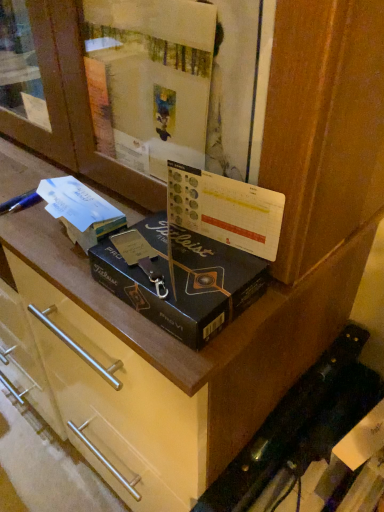
Question: Would you say black matte box at center is outside white paper at upper left?

Choices:
 (A) no
 (B) yes

Answer: (B)

Question: Is white paper at upper left a part of black matte box at center?

Choices:
 (A) yes
 (B) no

Answer: (B)

Question: From the image's perspective, would you say black matte box at center is positioned over white paper at upper left?

Choices:
 (A) no
 (B) yes

Answer: (A)

Question: From the image's perspective, is black matte box at center under white paper at upper left?

Choices:
 (A) no
 (B) yes

Answer: (B)

Question: Are black matte box at center and white paper at upper left located far from each other?

Choices:
 (A) no
 (B) yes

Answer: (A)

Question: Could you tell me if black matte box at center is facing white paper at upper left?

Choices:
 (A) yes
 (B) no

Answer: (B)

Question: Considering the relative positions of white paper at upper left and black matte box at center in the image provided, is white paper at upper left to the left of black matte box at center from the viewer's perspective?

Choices:
 (A) no
 (B) yes

Answer: (B)

Question: Does white paper at upper left turn towards black matte box at center?

Choices:
 (A) yes
 (B) no

Answer: (B)

Question: From the image's perspective, is white paper at upper left over black matte box at center?

Choices:
 (A) no
 (B) yes

Answer: (B)

Question: Is white paper at upper left to the right of black matte box at center from the viewer's perspective?

Choices:
 (A) yes
 (B) no

Answer: (B)

Question: Is the depth of white paper at upper left less than that of black matte box at center?

Choices:
 (A) no
 (B) yes

Answer: (A)

Question: Does white paper at upper left have a lesser height compared to black matte box at center?

Choices:
 (A) no
 (B) yes

Answer: (A)

Question: Would you say white paper at upper left is inside or outside black matte box at center?

Choices:
 (A) inside
 (B) outside

Answer: (B)